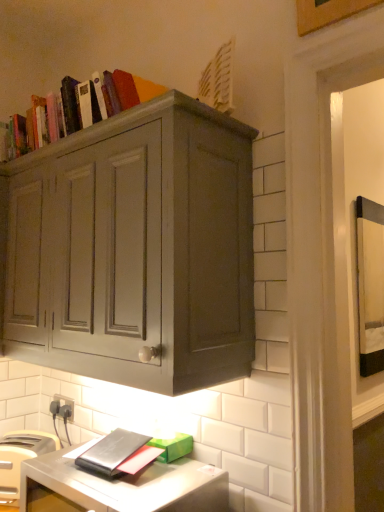
Question: Does white plastic toaster at lower left have a larger size compared to matte gray cabinet at upper center?

Choices:
 (A) no
 (B) yes

Answer: (A)

Question: Is white plastic toaster at lower left to the right of matte gray cabinet at upper center from the viewer's perspective?

Choices:
 (A) no
 (B) yes

Answer: (A)

Question: Is white plastic toaster at lower left next to matte gray cabinet at upper center and touching it?

Choices:
 (A) yes
 (B) no

Answer: (B)

Question: From the image's perspective, is white plastic toaster at lower left beneath matte gray cabinet at upper center?

Choices:
 (A) no
 (B) yes

Answer: (B)

Question: Considering the relative sizes of white plastic toaster at lower left and matte gray cabinet at upper center in the image provided, is white plastic toaster at lower left smaller than matte gray cabinet at upper center?

Choices:
 (A) yes
 (B) no

Answer: (A)

Question: Is matte gray cabinet at upper center surrounded by white plastic toaster at lower left?

Choices:
 (A) yes
 (B) no

Answer: (B)

Question: Is matte gray cabinet at upper center next to black plastic electric outlet at lower left?

Choices:
 (A) yes
 (B) no

Answer: (B)

Question: Can we say matte gray cabinet at upper center lies outside black plastic electric outlet at lower left?

Choices:
 (A) yes
 (B) no

Answer: (A)

Question: Is matte gray cabinet at upper center positioned with its back to black plastic electric outlet at lower left?

Choices:
 (A) yes
 (B) no

Answer: (B)

Question: Considering the relative sizes of matte gray cabinet at upper center and black plastic electric outlet at lower left in the image provided, is matte gray cabinet at upper center taller than black plastic electric outlet at lower left?

Choices:
 (A) yes
 (B) no

Answer: (A)

Question: Is matte gray cabinet at upper center smaller than black plastic electric outlet at lower left?

Choices:
 (A) yes
 (B) no

Answer: (B)

Question: Does matte gray cabinet at upper center appear on the left side of black plastic electric outlet at lower left?

Choices:
 (A) yes
 (B) no

Answer: (B)

Question: Is wooden picture frame at upper right oriented away from matte gray cabinet at upper center?

Choices:
 (A) no
 (B) yes

Answer: (A)